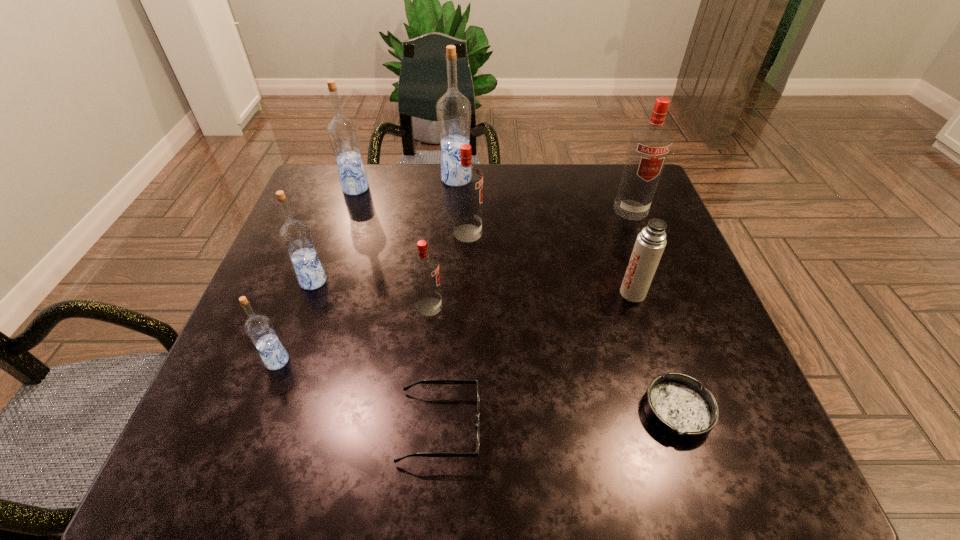
I want to click on the biggest blue vodka, so click(x=453, y=110).

Where is `the tallest vodka`? This screenshot has width=960, height=540. the tallest vodka is located at coordinates (453, 110).

Identify the location of the third smallest blue vodka. Image resolution: width=960 pixels, height=540 pixels. click(x=342, y=132).

The width and height of the screenshot is (960, 540). Find the location of `the fifth nearest vodka`. the fifth nearest vodka is located at coordinates (650, 144).

Locate an element on the screen. the farthest red vodka is located at coordinates (650, 144).

Find the location of a particular element. This screenshot has width=960, height=540. the second biggest red vodka is located at coordinates (466, 180).

At what (x,y) coordinates should I click in order to perform the action: click on the second nearest red vodka. Please return your answer as a coordinate pair (x, y). Looking at the image, I should click on (466, 180).

The image size is (960, 540). Identify the location of the second smallest blue vodka. (295, 235).

The width and height of the screenshot is (960, 540). What are the coordinates of `the third farthest blue vodka` in the screenshot? It's located at (295, 235).

Identify the location of thermos bottle. (651, 241).